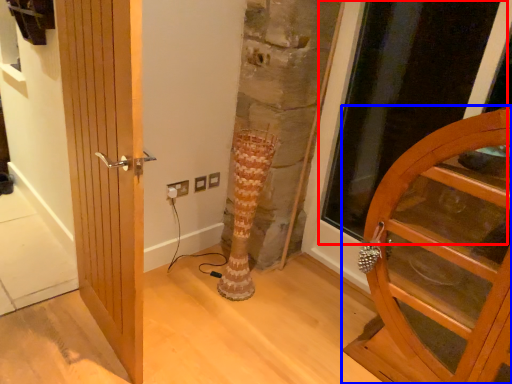
Question: Which object appears farthest to the camera in this image, glass door (highlighted by a red box) or door (highlighted by a blue box)?

Choices:
 (A) glass door
 (B) door

Answer: (A)